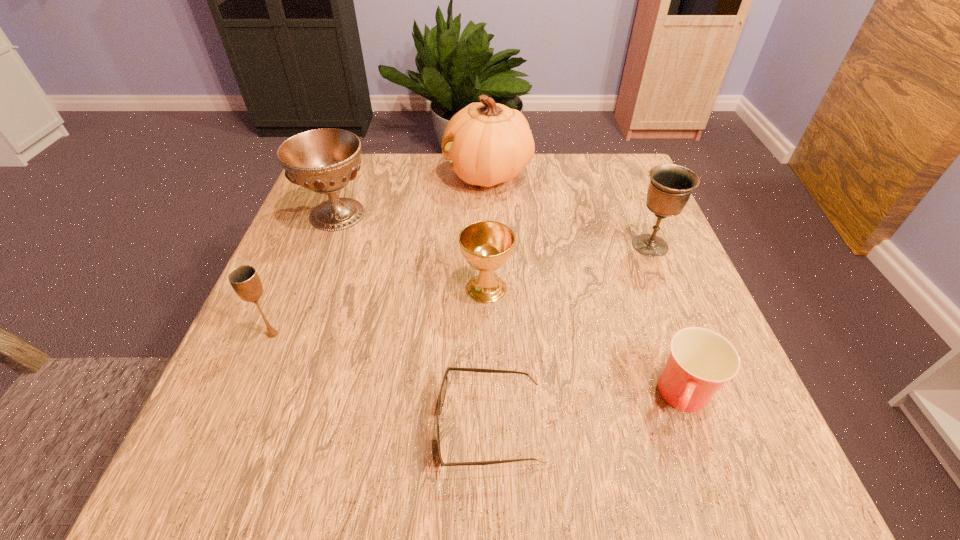
Identify the location of unoccupied area between the shortest chalice and the rightmost chalice. Image resolution: width=960 pixels, height=540 pixels. (568, 267).

This screenshot has height=540, width=960. I want to click on free space between the fifth farthest object and the tallest object, so click(380, 254).

This screenshot has height=540, width=960. Identify the location of vacant area that lies between the rightmost chalice and the tallest object. coord(569,210).

Find the location of a particular element. This screenshot has height=540, width=960. free space between the sunglasses and the nearest chalice is located at coordinates (381, 380).

The height and width of the screenshot is (540, 960). In order to click on vacant area between the rightmost chalice and the nearest chalice in this screenshot , I will do `click(462, 290)`.

In order to click on empty space between the shortest object and the fifth farthest object in this screenshot , I will do `click(381, 380)`.

The height and width of the screenshot is (540, 960). In order to click on free area in between the nearest chalice and the rightmost chalice in this screenshot , I will do `click(462, 290)`.

I want to click on object that is the third closest to the third chalice from left to right, so [x=487, y=143].

Identify the location of the second closest object to the fourth nearest object. Image resolution: width=960 pixels, height=540 pixels. (325, 160).

You are a GUI agent. You are given a task and a screenshot of the screen. Output one action in this format:
    pyautogui.click(x=<x>, y=<y>)
    Task: Click on the chalice identified as the second closest to the fifth farthest object
    The image size is (960, 540).
    Given the screenshot: What is the action you would take?
    pyautogui.click(x=486, y=245)